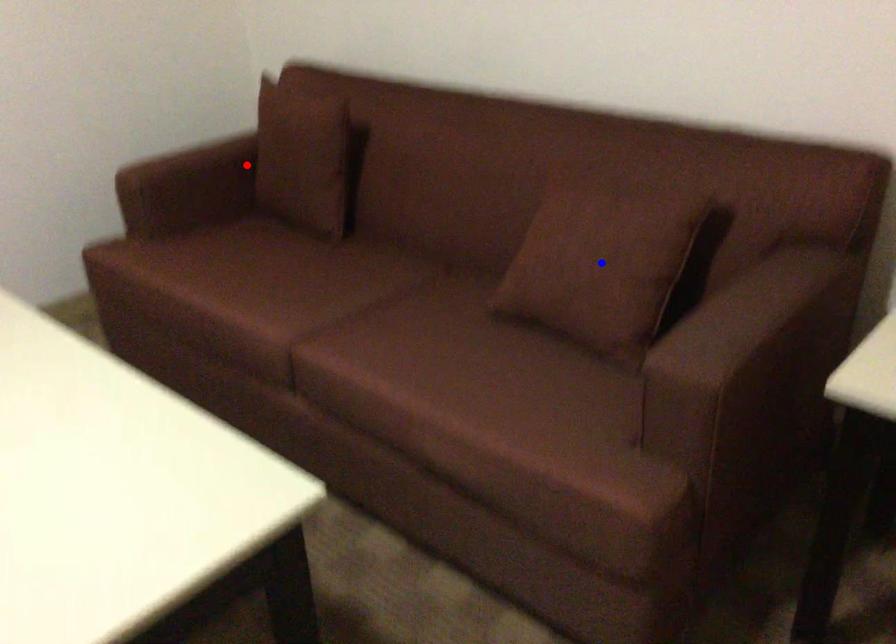
Question: In the image, two points are highlighted. Which point is nearer to the camera? Reply with the corresponding letter.

Choices:
 (A) blue point
 (B) red point

Answer: (A)